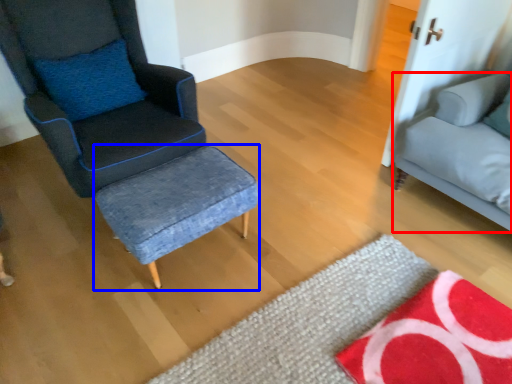
Question: Which object appears closest to the camera in this image, studio couch (highlighted by a red box) or stool (highlighted by a blue box)?

Choices:
 (A) studio couch
 (B) stool

Answer: (A)